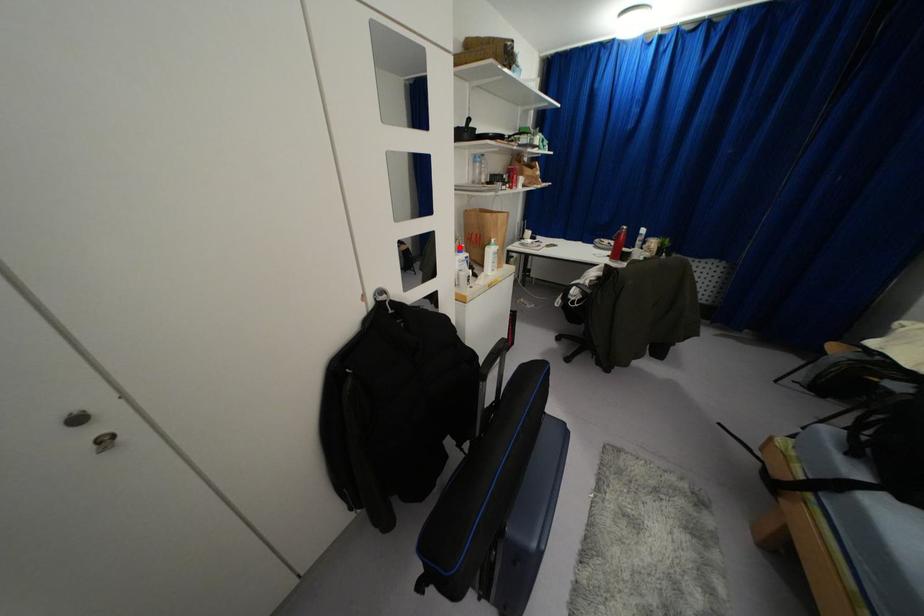
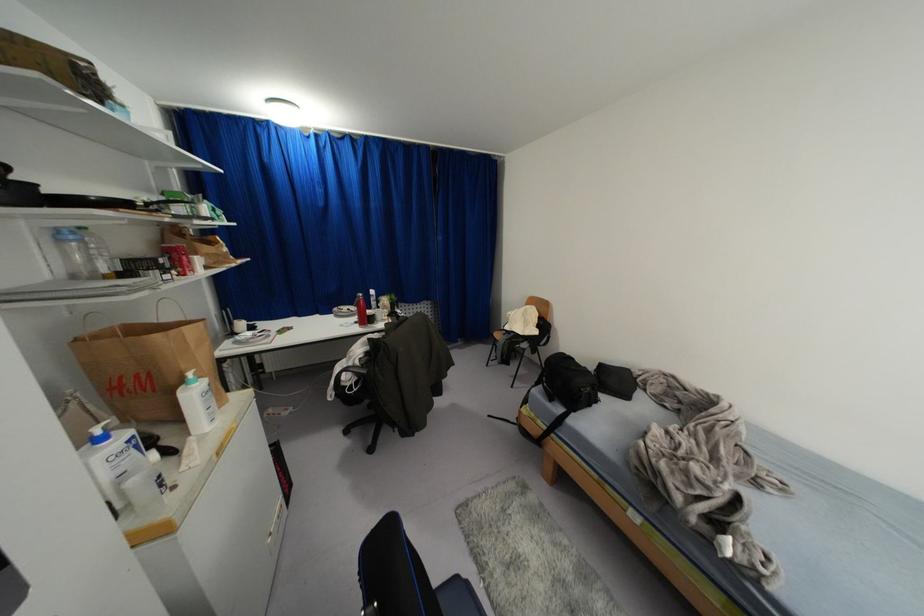
Locate, in the second image, the point that corresponds to the highlighted location in the first image.

(98, 431)